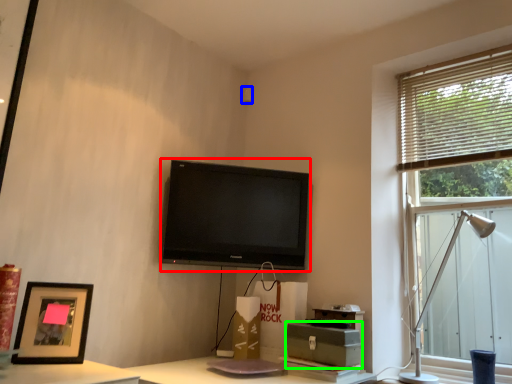
Question: Based on their relative distances, which object is farther from television (highlighted by a red box)? Choose from speaker (highlighted by a blue box) and cardboard box (highlighted by a green box).

Choices:
 (A) speaker
 (B) cardboard box

Answer: (A)